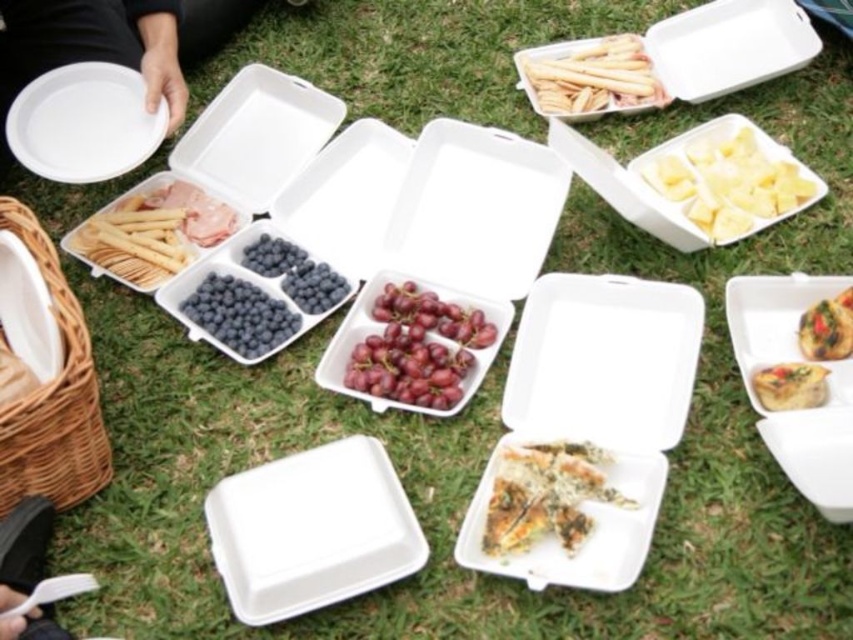
Question: Among these points, which one is nearest to the camera?

Choices:
 (A) (368, 288)
 (B) (833, 348)

Answer: (B)

Question: Does white foam tray at center appear under slightly toasted bread at center right?

Choices:
 (A) yes
 (B) no

Answer: (A)

Question: Which object is the farthest from the purple matte grapes at center?

Choices:
 (A) matte yellow quiche at center
 (B) slightly toasted bread at center right
 (C) yellow matte pineapple at upper right

Answer: (B)

Question: Does matte white tray at center-left have a smaller size compared to golden crispy pastry at right?

Choices:
 (A) no
 (B) yes

Answer: (A)

Question: Is white foam tray at upper right to the right of matte pink meat at upper left from the viewer's perspective?

Choices:
 (A) no
 (B) yes

Answer: (B)

Question: Which object is positioned closest to the slightly toasted bread at center right?

Choices:
 (A) white plastic spoon at lower left
 (B) matte yellow quiche at center
 (C) blueberry container at center
 (D) white styrofoam tray at center

Answer: (B)